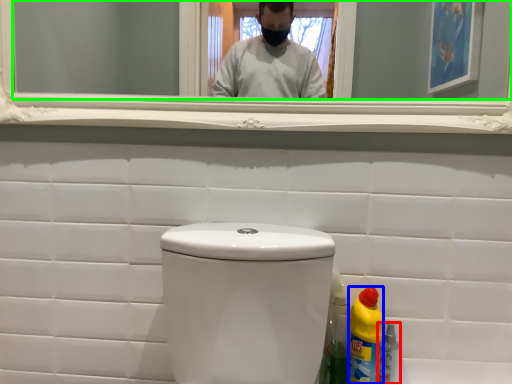
Question: Which object is positioned farthest from bottle (highlighted by a red box)? Select from bottle (highlighted by a blue box) and mirror (highlighted by a green box).

Choices:
 (A) bottle
 (B) mirror

Answer: (B)